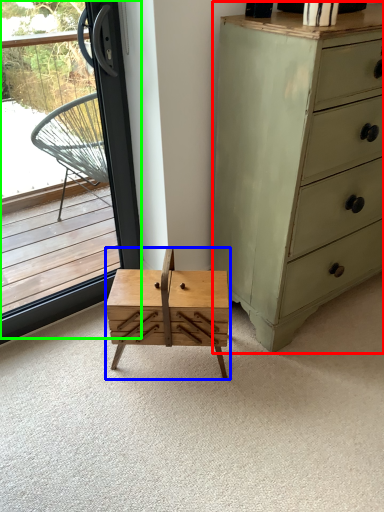
Question: Based on their relative distances, which object is nearer to chest of drawers (highlighted by a red box)? Choose from table (highlighted by a blue box) and window (highlighted by a green box).

Choices:
 (A) table
 (B) window

Answer: (A)